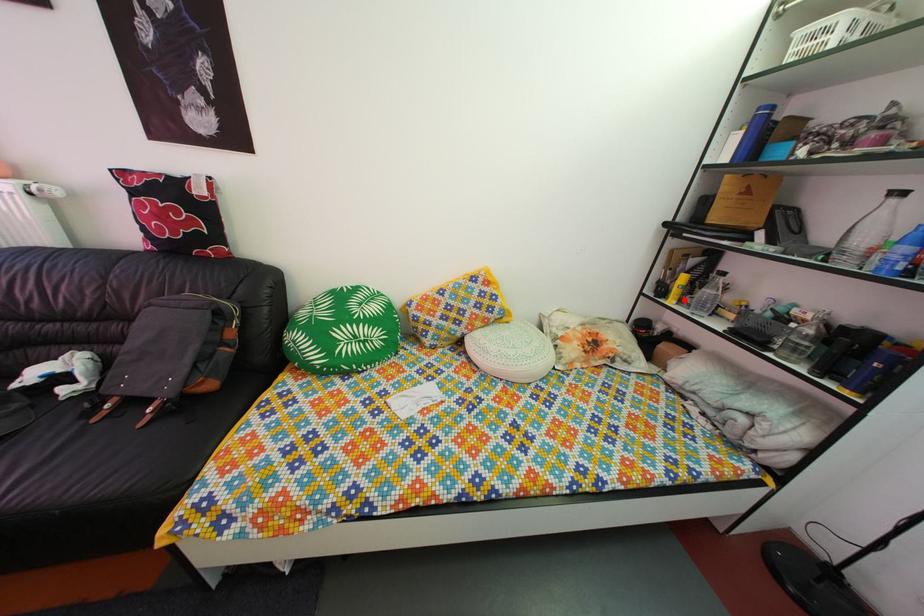
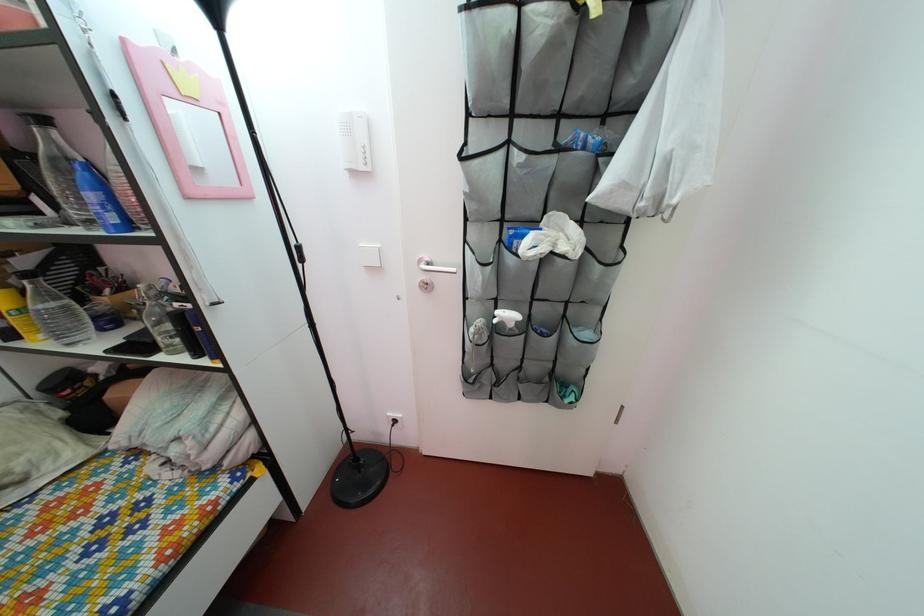
The point at the highlighted location is marked in the first image. Where is the corresponding point in the second image?

(27, 330)